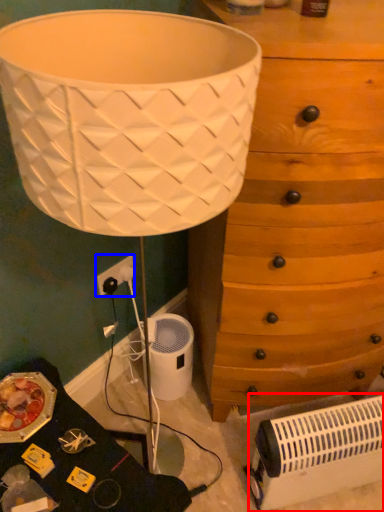
Question: Which object appears farthest to the camera in this image, heater (highlighted by a red box) or electric outlet (highlighted by a blue box)?

Choices:
 (A) heater
 (B) electric outlet

Answer: (B)